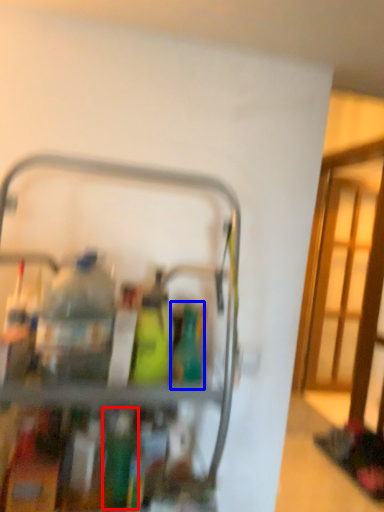
Question: Which of the following is the closest to the observer, bottle (highlighted by a red box) or bottle (highlighted by a blue box)?

Choices:
 (A) bottle
 (B) bottle

Answer: (A)